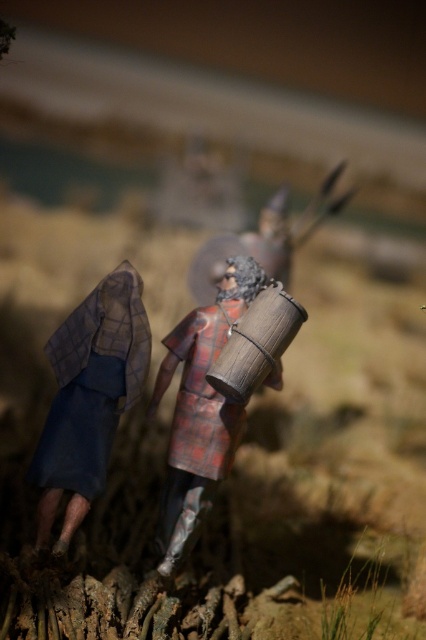
Question: Is blue fabric cloak at left bigger than wooden barrel at center?

Choices:
 (A) no
 (B) yes

Answer: (A)

Question: Which of the following is the closest to the observer?

Choices:
 (A) wooden barrel at center
 (B) blue fabric cloak at left

Answer: (B)

Question: Does blue fabric cloak at left have a lesser width compared to wooden barrel at center?

Choices:
 (A) yes
 (B) no

Answer: (A)

Question: Is blue fabric cloak at left positioned in front of wooden barrel at center?

Choices:
 (A) yes
 (B) no

Answer: (A)